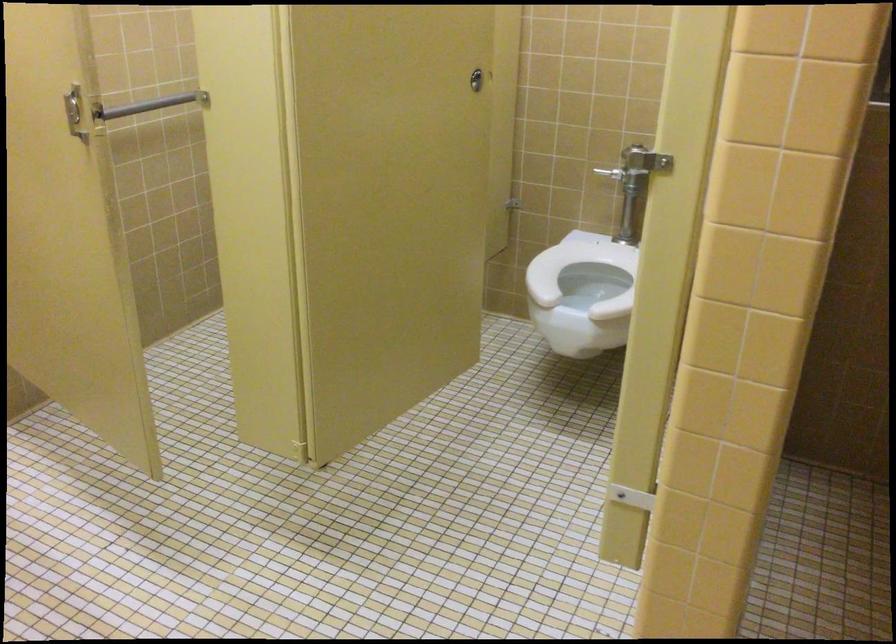
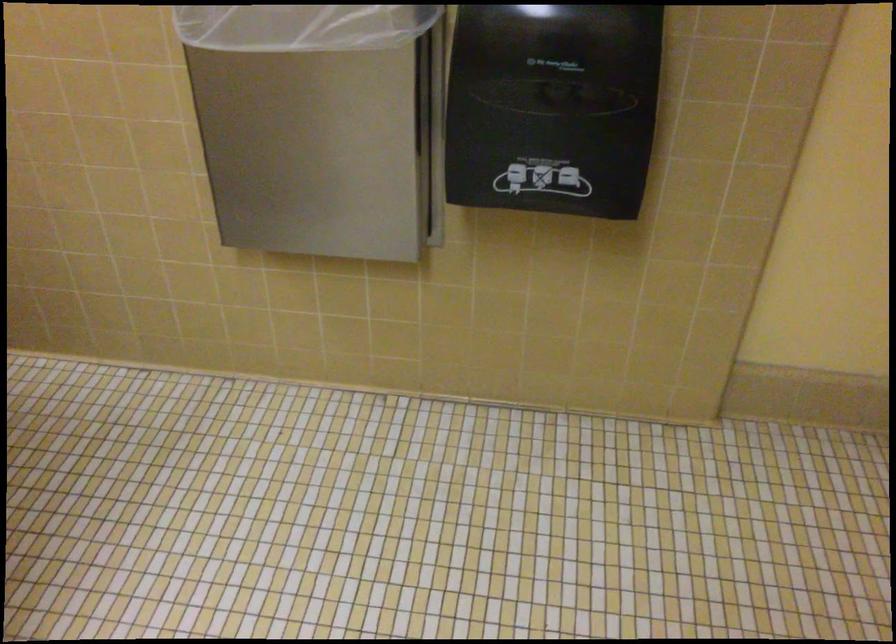
First-person continuous shooting, in which direction is the camera rotating?

The camera rotated toward right-down.